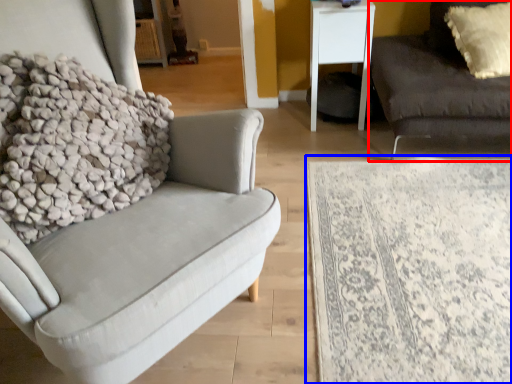
Question: Which object appears farthest to the camera in this image, studio couch (highlighted by a red box) or plain (highlighted by a blue box)?

Choices:
 (A) studio couch
 (B) plain

Answer: (A)